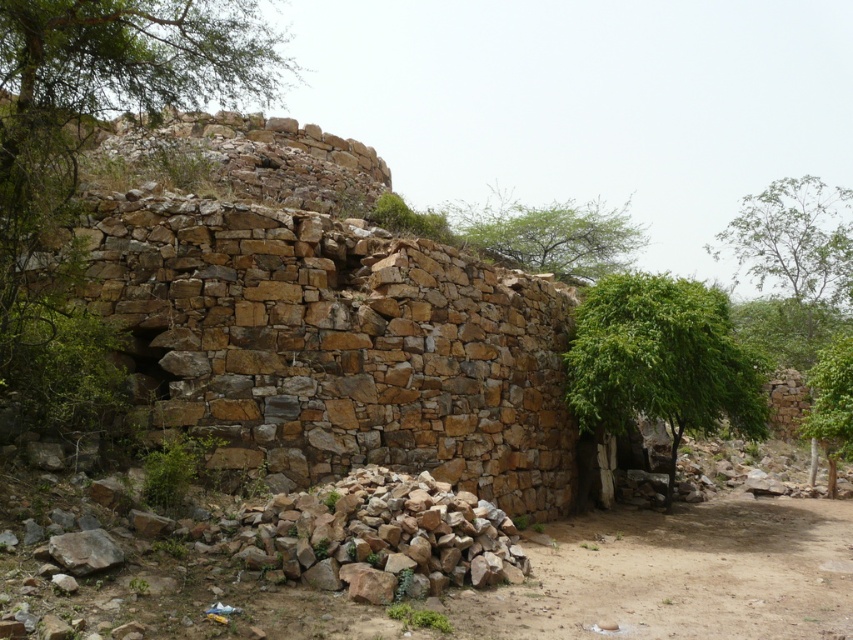
Question: Is green leafy tree at center below green leafy tree at upper right?

Choices:
 (A) yes
 (B) no

Answer: (A)

Question: Which point is closer to the camera?

Choices:
 (A) (596, 429)
 (B) (811, 406)
 (C) (776, 289)

Answer: (A)

Question: Estimate the real-world distances between objects in this image. Which object is farther from the green leafy tree at right?

Choices:
 (A) green leafy tree at upper center
 (B) green leafy tree at center
 (C) green leafy tree at upper right

Answer: (C)

Question: Does green leafy tree at center appear on the left side of green leafy tree at upper right?

Choices:
 (A) yes
 (B) no

Answer: (A)

Question: Which of these objects is positioned farthest from the green leafy tree at upper center?

Choices:
 (A) green leafy tree at center
 (B) green leafy tree at right
 (C) green leafy tree at upper right

Answer: (B)

Question: Is green leafy tree at upper right smaller than green leafy tree at right?

Choices:
 (A) no
 (B) yes

Answer: (A)